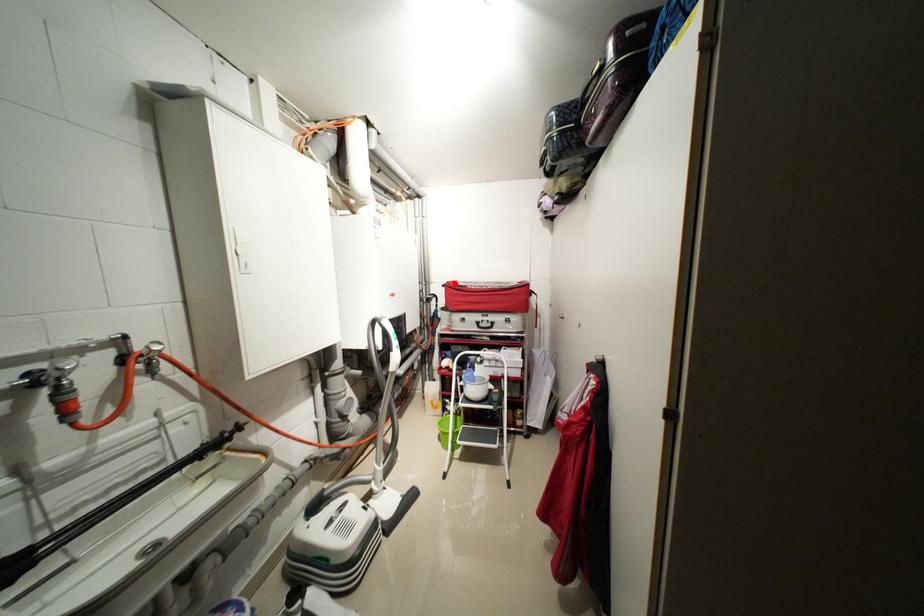
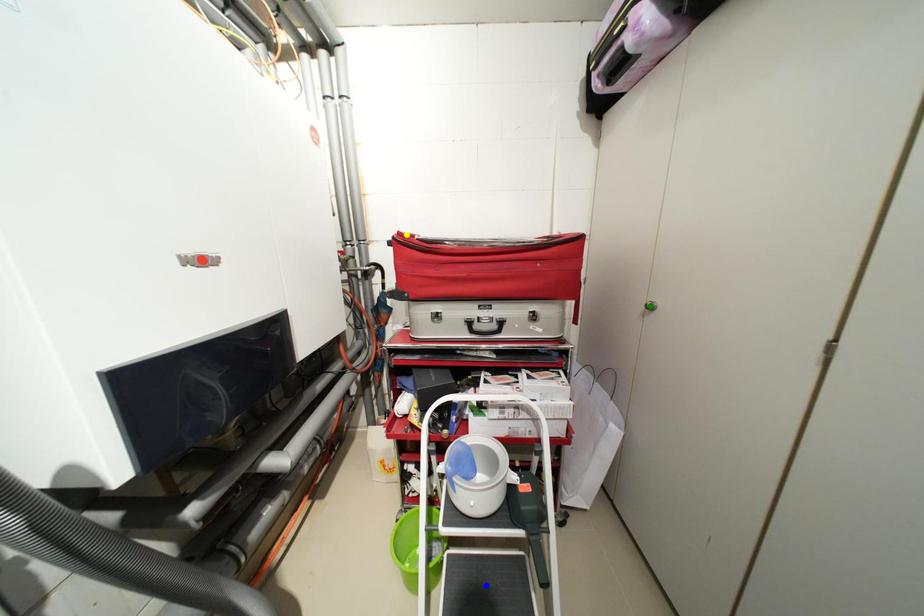
Question: I am providing you with two images of the same scene from different viewpoints. A red point is marked on the first image. You are given multiple points on the second image. Which point in image 2 represents the same 3d spot as the red point in image 1?

Choices:
 (A) blue point
 (B) yellow point
 (C) green point

Answer: (B)